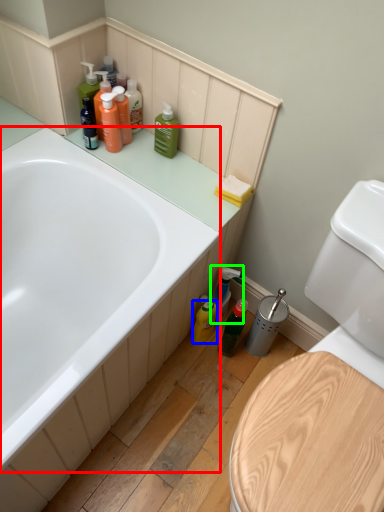
Question: Which object is positioned farthest from bathtub (highlighted by a red box)? Select from cleaning product (highlighted by a blue box) and cleaning product (highlighted by a green box).

Choices:
 (A) cleaning product
 (B) cleaning product

Answer: (A)